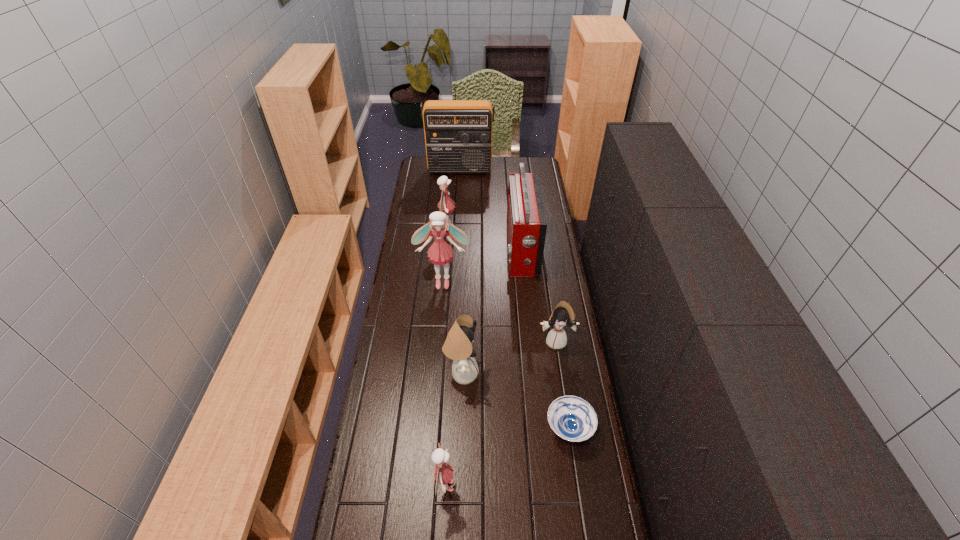
This screenshot has height=540, width=960. I want to click on free space located 0.070m at the front face of the left black doll, so click(x=498, y=373).

I want to click on vacant region located 0.050m on the front-facing side of the nearest doll, so click(472, 486).

Image resolution: width=960 pixels, height=540 pixels. Identify the location of vacant space located 0.110m at the front face of the right black doll. (561, 375).

You are a GUI agent. You are given a task and a screenshot of the screen. Output one action in this format:
    pyautogui.click(x=<x>, y=<y>)
    Task: Click on the free location located on the left of the soup bowl
    The height and width of the screenshot is (540, 960).
    Given the screenshot: What is the action you would take?
    pyautogui.click(x=497, y=428)

Where is `object that is at the far edge`? object that is at the far edge is located at coordinates (458, 133).

Identify the location of radio receiver located in the left edge section of the desktop. (458, 133).

Find the location of a particular element. Image resolution: width=960 pixels, height=540 pixels. doll located at the left edge is located at coordinates (439, 253).

The height and width of the screenshot is (540, 960). I want to click on radio receiver that is at the right edge, so click(x=526, y=221).

This screenshot has height=540, width=960. Identify the location of doll that is at the right edge. (563, 314).

Where is `soup bowl that is at the right edge`? This screenshot has width=960, height=540. soup bowl that is at the right edge is located at coordinates (572, 418).